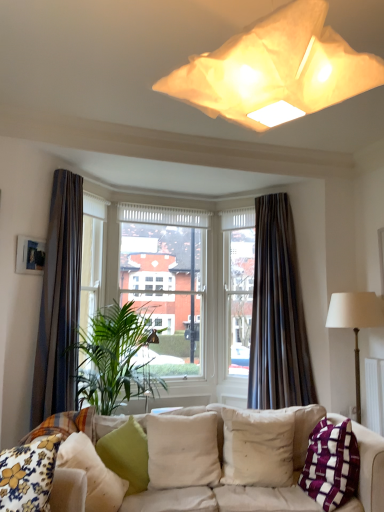
Question: From the image's perspective, is purple woven pillow at lower right, which appears as the first pillow when viewed from the right, above or below dark velvet curtain at center, the second curtain from the left?

Choices:
 (A) below
 (B) above

Answer: (A)

Question: Choose the correct answer: Is purple woven pillow at lower right, which appears as the first pillow when viewed from the right, inside dark velvet curtain at center, which ranks as the first curtain in right-to-left order, or outside it?

Choices:
 (A) outside
 (B) inside

Answer: (A)

Question: Estimate the real-world distances between objects in this image. Which object is closer to the matte paper lampshade at upper center?

Choices:
 (A) floral fabric cushion at lower left, the 1th pillow positioned from the left
 (B) white fabric couch at lower center
 (C) green leafy plant at center
 (D) brown fabric curtain at left, arranged as the first curtain when viewed from the left
 (E) wooden picture frame at upper left

Answer: (A)

Question: Which object is the closest to the matte paper lampshade at upper center?

Choices:
 (A) floral fabric cushion at lower left, the sixth pillow positioned from the right
 (B) beige fabric pillow at center, positioned as the fifth pillow in left-to-right order
 (C) green fabric pillow at lower left, arranged as the 2th pillow when viewed from the left
 (D) clear glass window at center
 (E) dark velvet curtain at center, which ranks as the first curtain in right-to-left order

Answer: (A)